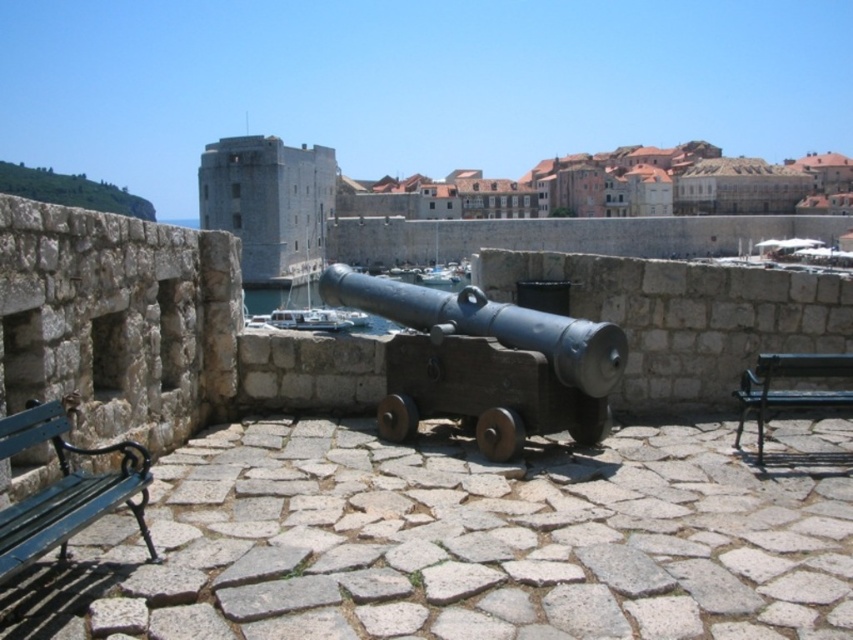
You are a tour guide leading a group to the green metal bench at lower right. You see the matte black cannon at center in your path. Can you walk around the cannon to reach the bench?

The green metal bench at lower right is behind the matte black cannon at center, so you can walk around the cannon to reach the bench.

You are standing at the entrance of the historical site and want to take a photo of the smooth stone cannon at center from the green wooden bench at lower left. Is the cannon visible from the bench?

The smooth stone cannon at center is above the green wooden bench at lower left, so yes, the cannon is visible from the bench.

You are a tour guide explaining the historical site to visitors. You mention the matte black cannon at center and the green metal bench at lower right. Which object is bigger?

The matte black cannon at center is larger in size compared to the green metal bench at lower right.